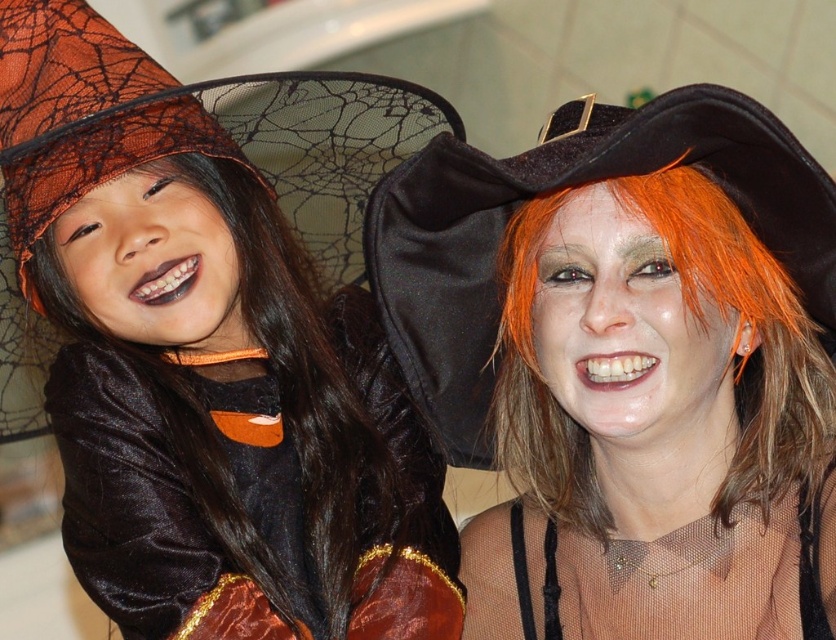
Question: Considering the relative positions of velvet black dress at left and black velvet witch hat at upper right in the image provided, where is velvet black dress at left located with respect to black velvet witch hat at upper right?

Choices:
 (A) below
 (B) above

Answer: (A)

Question: Among these objects, which one is nearest to the camera?

Choices:
 (A) black velvet witch hat at upper right
 (B) velvet black dress at left
 (C) matte black witch hat at upper left

Answer: (A)

Question: Which of the following is the farthest from the observer?

Choices:
 (A) (431, 228)
 (B) (375, 605)
 (C) (381, 387)

Answer: (C)

Question: Which object is positioned farthest from the velvet black dress at left?

Choices:
 (A) black velvet witch hat at upper right
 (B) matte black witch hat at upper left

Answer: (A)

Question: Does velvet black dress at left appear over black velvet witch hat at upper right?

Choices:
 (A) no
 (B) yes

Answer: (A)

Question: Is velvet black dress at left to the right of black velvet witch hat at upper right from the viewer's perspective?

Choices:
 (A) yes
 (B) no

Answer: (B)